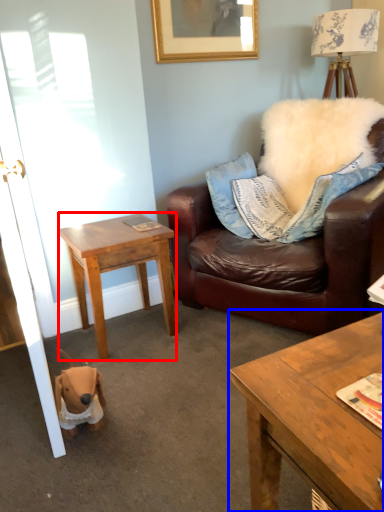
Question: Which point is closer to the camera, desk (highlighted by a red box) or coffee table (highlighted by a blue box)?

Choices:
 (A) desk
 (B) coffee table

Answer: (B)